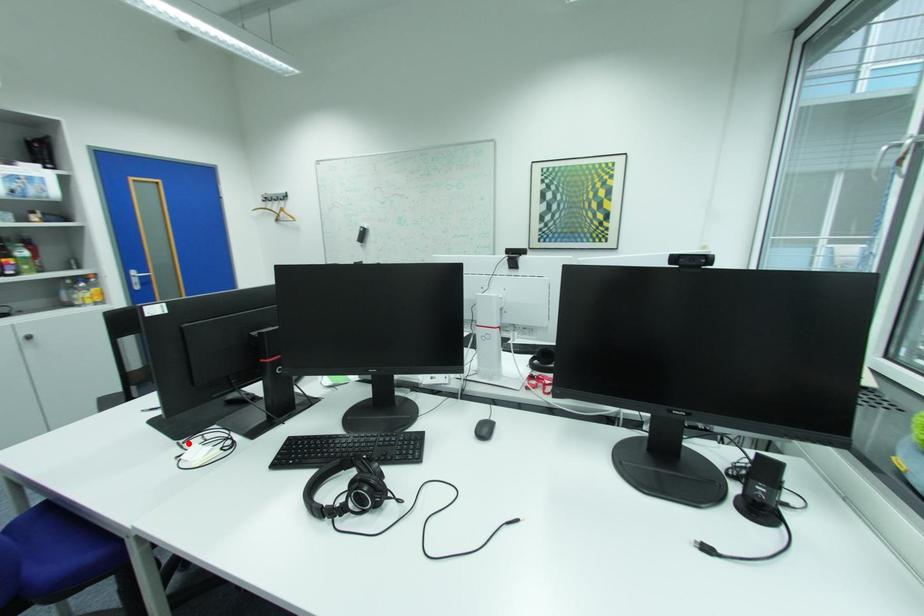
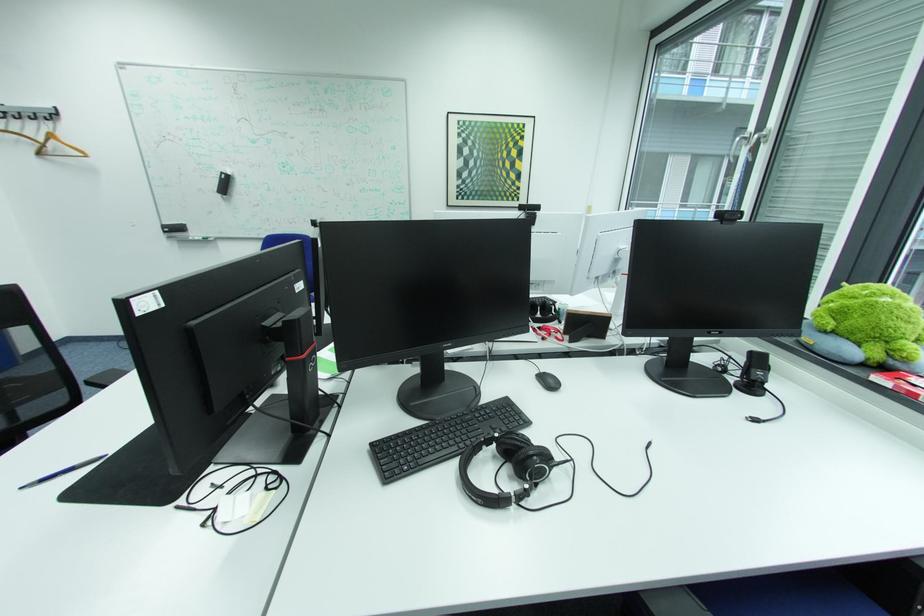
Find the pixel in the second image that matches the highlighted location in the first image.

(187, 508)